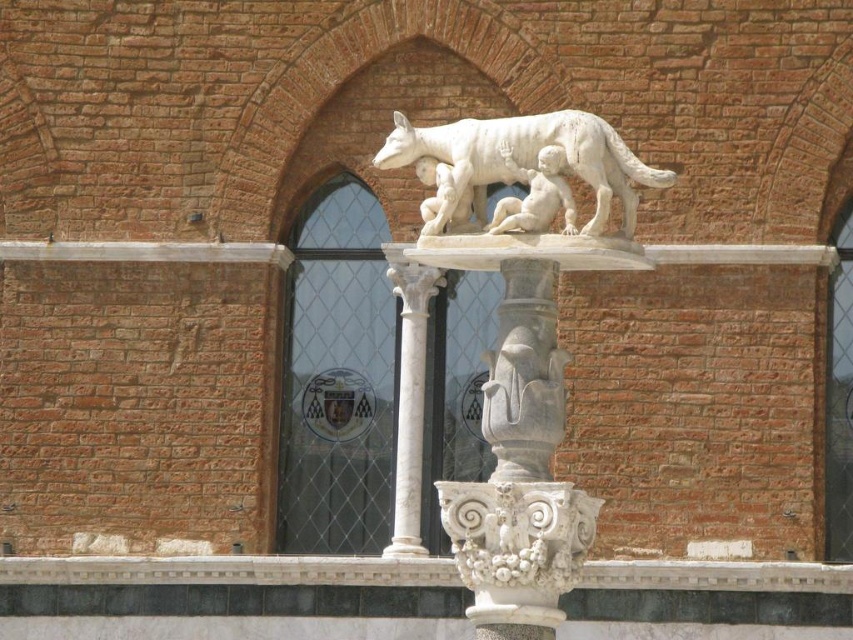
Question: Which point is farther from the camera taking this photo?

Choices:
 (A) (401, 538)
 (B) (540, 164)

Answer: (A)

Question: Which point appears farthest from the camera in this image?

Choices:
 (A) (399, 387)
 (B) (509, 125)
 (C) (534, 202)

Answer: (A)

Question: Does white marble column at center appear on the right side of white marble baby at upper center?

Choices:
 (A) yes
 (B) no

Answer: (B)

Question: Is white marble column at center thinner than white marble baby at upper center?

Choices:
 (A) yes
 (B) no

Answer: (A)

Question: Can you confirm if white marble column at center is wider than white marble baby at upper center?

Choices:
 (A) yes
 (B) no

Answer: (B)

Question: Which of the following is the farthest from the observer?

Choices:
 (A) (415, 476)
 (B) (564, 188)
 (C) (505, 138)

Answer: (A)